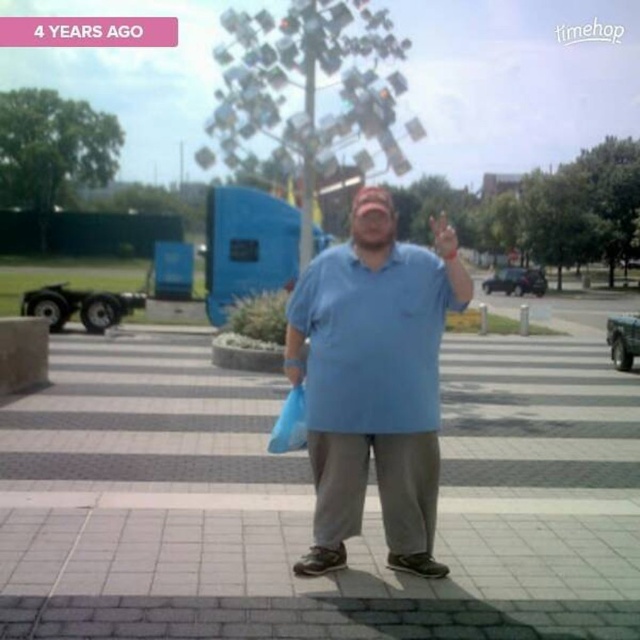
Question: Which object is the closest to the blue cotton polo shirt at center?

Choices:
 (A) blue cotton shirt at center
 (B) matte plastic hand at center
 (C) blue plastic bag at center

Answer: (A)

Question: Is blue cotton shirt at center closer to camera compared to blue plastic bag at center?

Choices:
 (A) yes
 (B) no

Answer: (A)

Question: Is blue cotton polo shirt at center to the right of blue plastic bag at center from the viewer's perspective?

Choices:
 (A) yes
 (B) no

Answer: (A)

Question: From the image, what is the correct spatial relationship of blue cotton polo shirt at center in relation to matte plastic hand at center?

Choices:
 (A) below
 (B) above

Answer: (A)

Question: Which point is closer to the camera?

Choices:
 (A) (408, 428)
 (B) (381, 250)

Answer: (A)

Question: Which point is closer to the camera?

Choices:
 (A) matte plastic hand at center
 (B) blue cotton polo shirt at center
 (C) blue cotton shirt at center
 (D) blue plastic bag at center

Answer: (A)